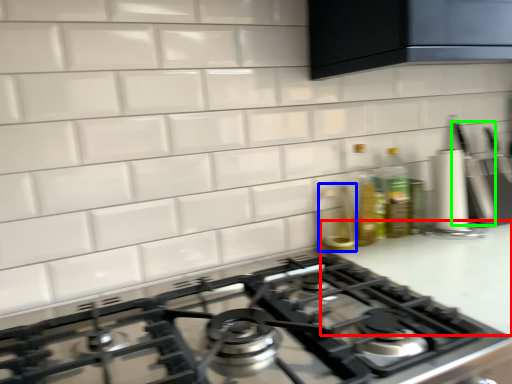
Question: Based on their relative distances, which object is farther from counter top (highlighted by a red box)? Choose from appliance (highlighted by a blue box) and kitchen appliance (highlighted by a green box).

Choices:
 (A) appliance
 (B) kitchen appliance

Answer: (B)